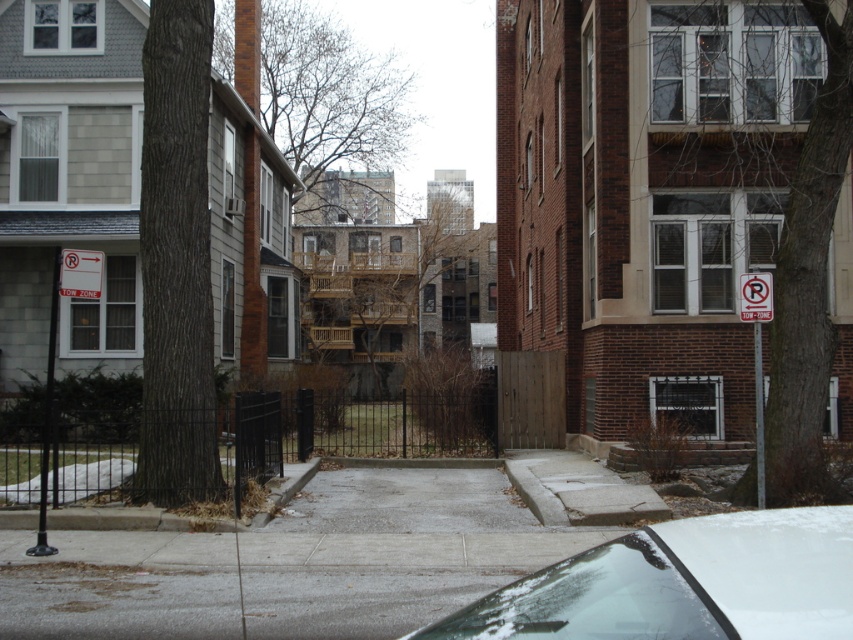
Between gray concrete pavement at center and bare branches at upper center, which one has less height?

gray concrete pavement at center

Is gray concrete pavement at center shorter than bare branches at upper center?

Indeed, gray concrete pavement at center has a lesser height compared to bare branches at upper center.

Is point (32, 620) positioned after point (350, 148)?

No.

I want to click on gray concrete pavement at center, so click(392, 550).

Does brown rough bark tree at left have a lesser height compared to brown bark tree at right?

In fact, brown rough bark tree at left may be taller than brown bark tree at right.

Which is behind, point (172, 432) or point (828, 164)?

The point (172, 432) is more distant.

Find the location of a particular element. brown rough bark tree at left is located at coordinates (177, 260).

Describe the element at coordinates (392, 550) in the screenshot. This screenshot has height=640, width=853. I see `gray concrete pavement at center` at that location.

Between gray concrete pavement at center and brown wooden tree at center, which one appears on the left side from the viewer's perspective?

brown wooden tree at center

Who is more distant from viewer, (265, 596) or (432, 256)?

The point (432, 256) is behind.

Locate an element on the screen. The width and height of the screenshot is (853, 640). gray concrete pavement at center is located at coordinates (392, 550).